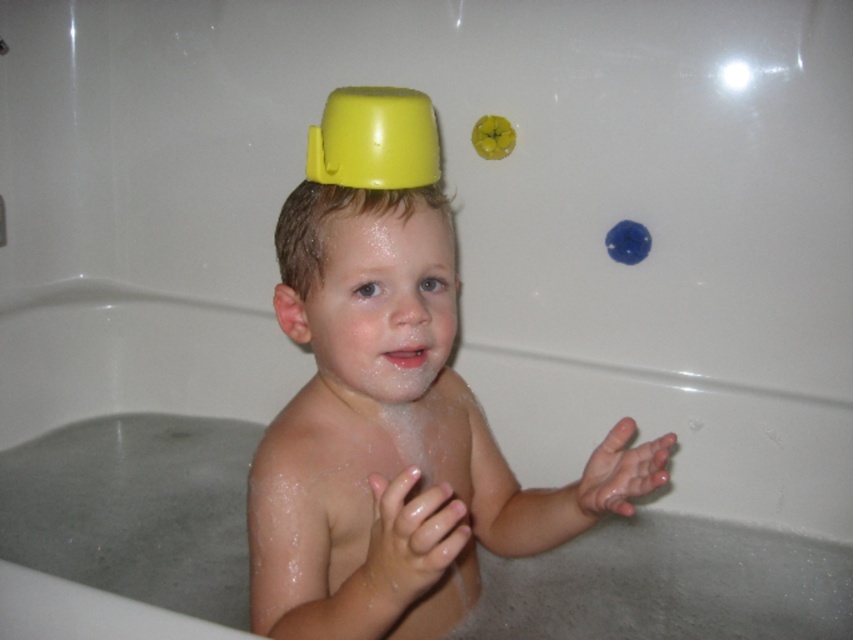
Question: Is yellow matte cup at center positioned in front of yellow plastic knob at upper center?

Choices:
 (A) yes
 (B) no

Answer: (A)

Question: Which point is closer to the camera?

Choices:
 (A) yellow plastic cup at upper center
 (B) transparent plastic bubble at upper right
 (C) shiny skin at center
 (D) yellow plastic knob at upper center

Answer: (A)

Question: Can you confirm if yellow plastic cup at upper center is positioned below yellow plastic knob at upper center?

Choices:
 (A) no
 (B) yes

Answer: (B)

Question: Is yellow matte cup at center closer to camera compared to yellow plastic knob at upper center?

Choices:
 (A) no
 (B) yes

Answer: (B)

Question: Which of the following is the farthest from the observer?

Choices:
 (A) transparent plastic bubble at upper right
 (B) yellow plastic knob at upper center

Answer: (B)

Question: Which object is the closest to the yellow matte cup at center?

Choices:
 (A) yellow plastic knob at upper center
 (B) yellow plastic cup at upper center
 (C) transparent plastic bubble at upper right

Answer: (B)